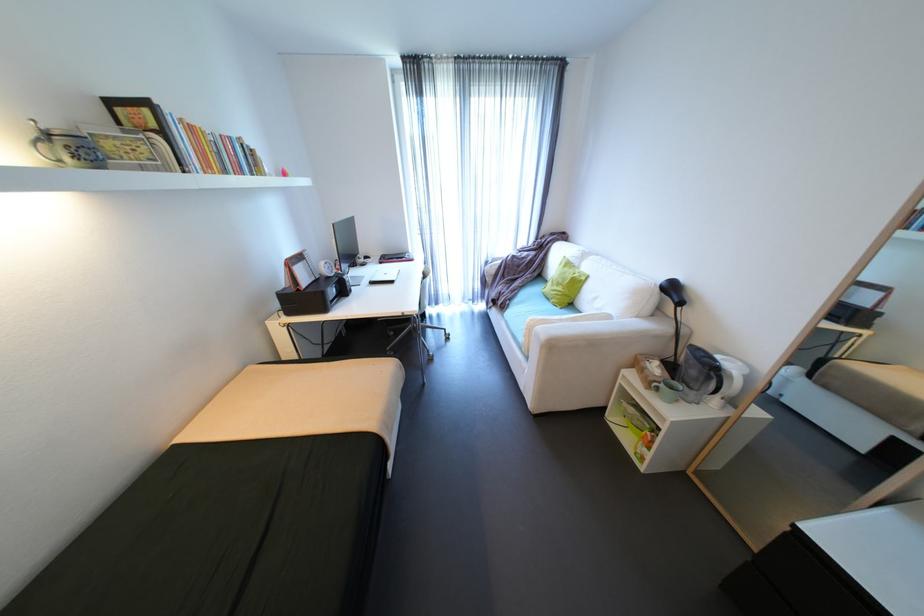
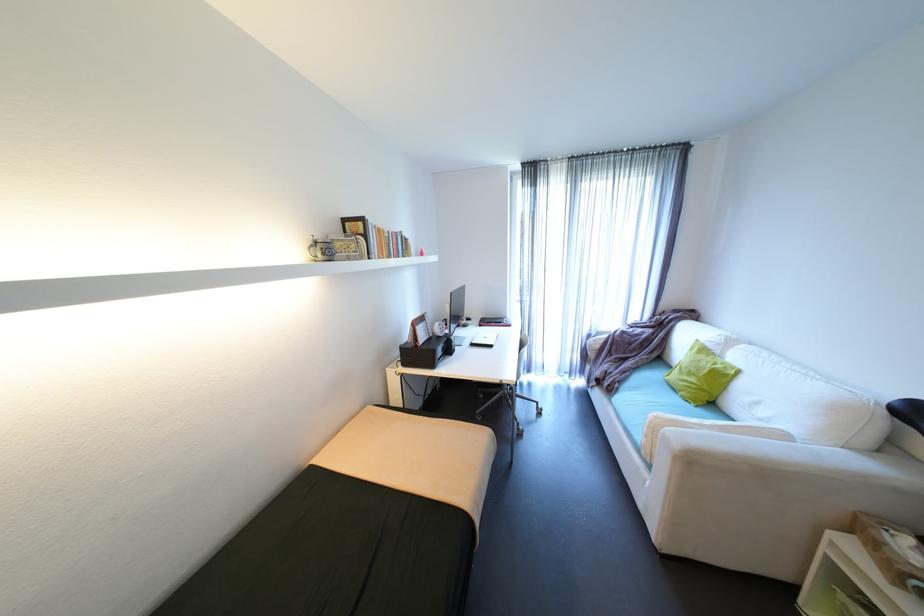
In the second image, find the point that corresponds to point 341,225 in the first image.

(458, 294)